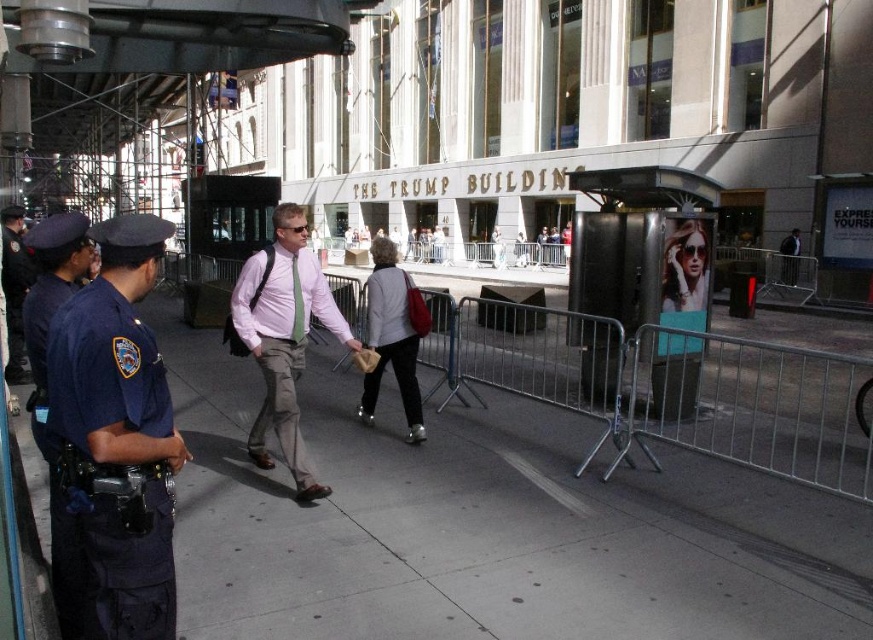
Question: Which object is the closest to the metallic silver barrier at center?

Choices:
 (A) dark blue uniform at left
 (B) light brown leather jacket at center

Answer: (A)

Question: Among these points, which one is farthest from the camera?

Choices:
 (A) (789, 272)
 (B) (5, 289)
 (C) (76, 541)

Answer: (A)

Question: Can you confirm if pink fabric shirt at center is smaller than light brown leather jacket at center?

Choices:
 (A) yes
 (B) no

Answer: (A)

Question: Does blue uniform at left appear on the left side of dark blue uniform at left?

Choices:
 (A) yes
 (B) no

Answer: (B)

Question: Can you confirm if metallic silver barrier at center is smaller than pink fabric shirt at center?

Choices:
 (A) no
 (B) yes

Answer: (A)

Question: Among these objects, which one is nearest to the camera?

Choices:
 (A) gray concrete sidewalk at center
 (B) dark blue uniform at left

Answer: (A)